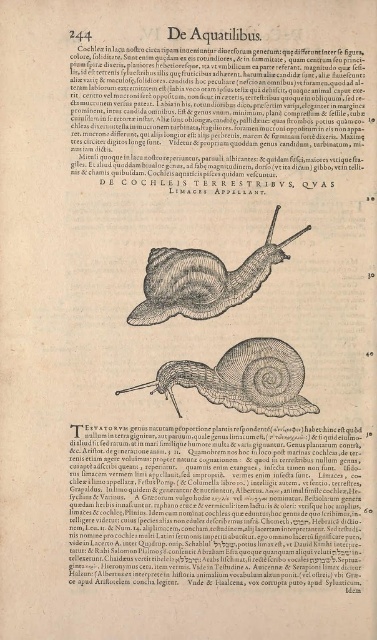
Does point (200, 109) lie in front of point (171, 394)?

Yes, it is.

Image resolution: width=377 pixels, height=640 pixels. Identify the location of matte black snail at center. click(214, 115).

You are a GUI agent. You are given a task and a screenshot of the screen. Output one action in this format:
    pyautogui.click(x=<x>, y=<y>)
    Task: Click on the matte black snail at center
    
    Given the screenshot: What is the action you would take?
    pyautogui.click(x=214, y=115)

Does matte yellow paper at upper center appear on the right side of brown wood snail at center?

No, matte yellow paper at upper center is not to the right of brown wood snail at center.

Find the location of a particular element. This screenshot has width=377, height=640. matte yellow paper at upper center is located at coordinates (216, 506).

Which of these two, matte yellow paper at upper center or matte black snail at center, stands shorter?

With less height is matte black snail at center.

This screenshot has width=377, height=640. I want to click on matte yellow paper at upper center, so click(x=216, y=506).

Between point (105, 538) and point (277, 74), which one is positioned behind?

The point (105, 538) is more distant.

Find the location of `matte yellow paper at upper center`. matte yellow paper at upper center is located at coordinates (216, 506).